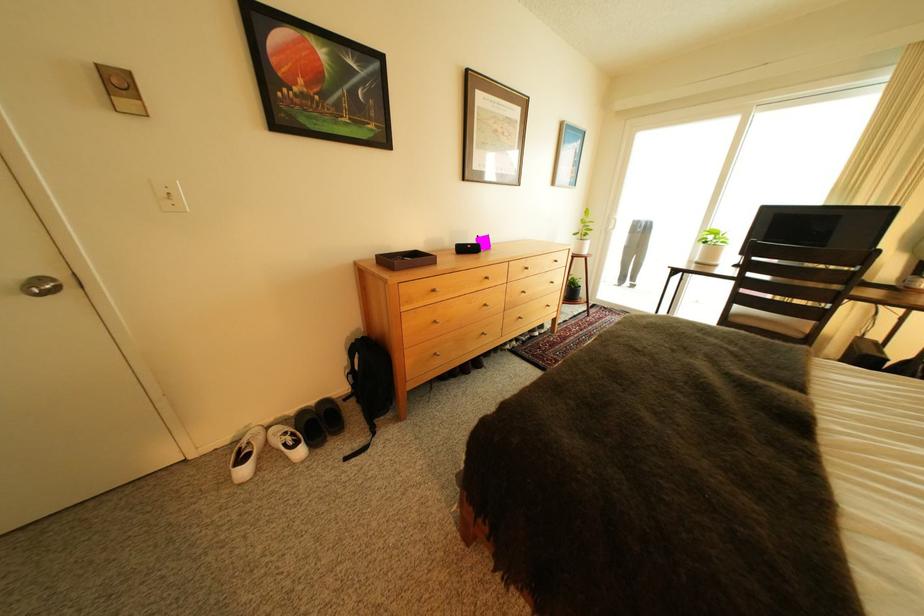
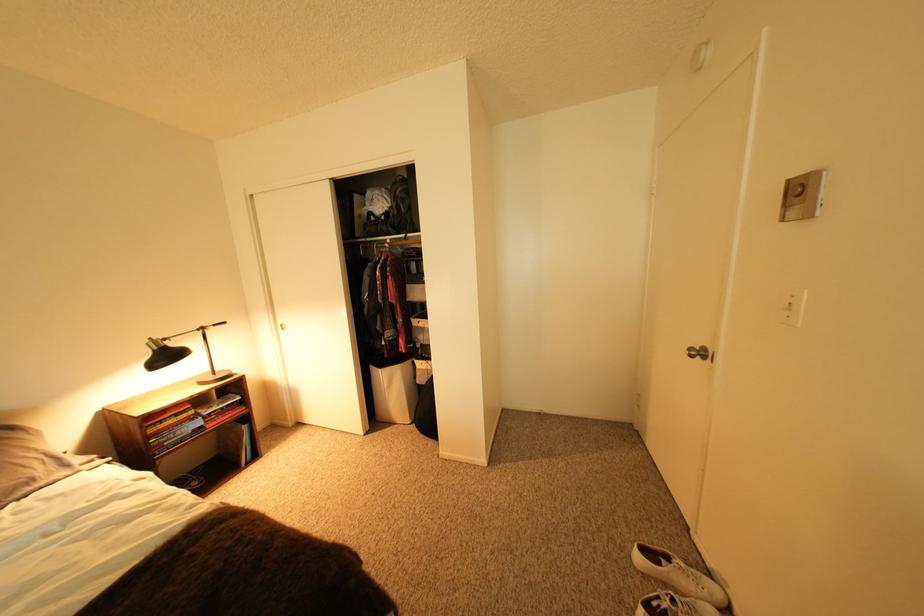
The point at (152, 103) is marked in the first image. Where is the corresponding point in the second image?

(816, 207)